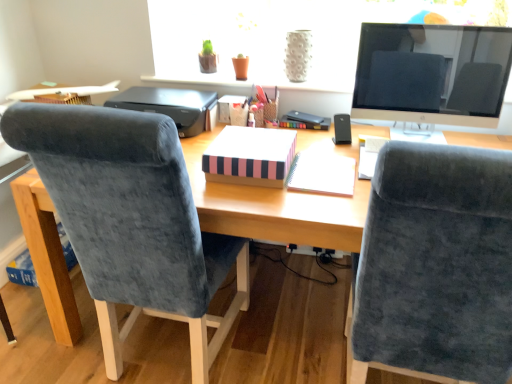
This screenshot has width=512, height=384. What are the coordinates of `free space to the left of black plastic speaker at right` in the screenshot? It's located at (316, 137).